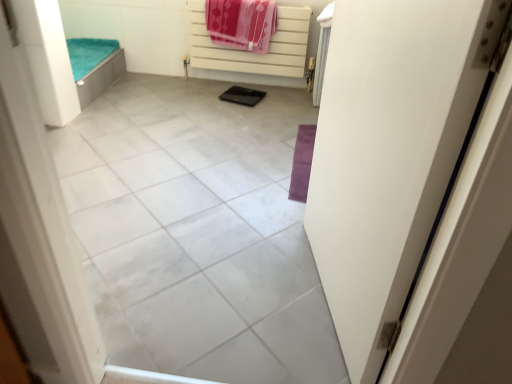
Where is `free space to the back side of white matte door at right`? free space to the back side of white matte door at right is located at coordinates (265, 200).